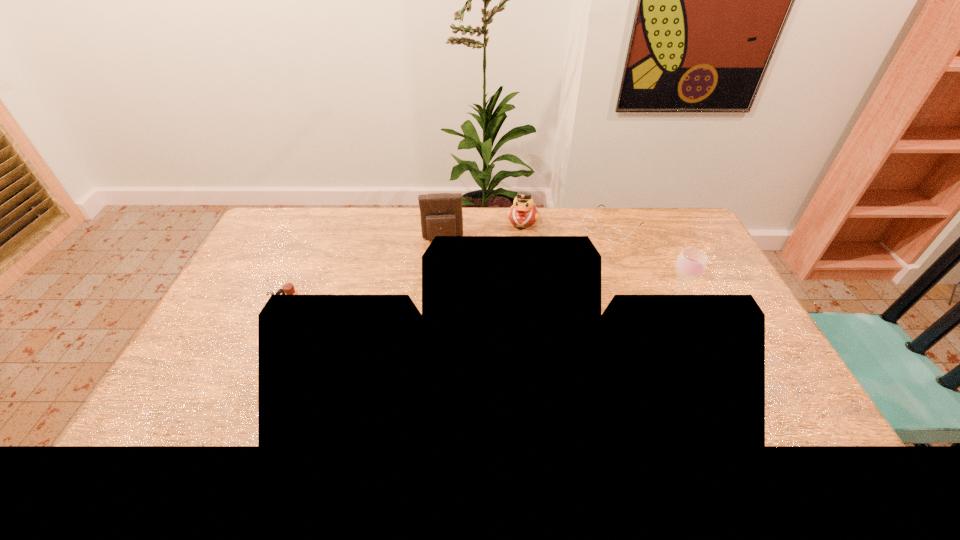
Identify the location of the leftmost object. (288, 289).

The width and height of the screenshot is (960, 540). Identify the location of wineglass. (691, 263).

Identify the location of the second object from left to right. (441, 214).

Locate an element on the screen. Image resolution: width=960 pixels, height=540 pixels. duck is located at coordinates (523, 213).

Identify the location of spectacles. The height and width of the screenshot is (540, 960). tap(614, 235).

Find the location of a particular element. The image size is (960, 540). vacant area located holding a crossbow in the hands of the Lego is located at coordinates (257, 310).

Where is `free space located 0.120m holding a crossbow in the hands of the Lego`? The image size is (960, 540). free space located 0.120m holding a crossbow in the hands of the Lego is located at coordinates (235, 310).

Find the location of a particular element. The width and height of the screenshot is (960, 540). vacant point located holding a crossbow in the hands of the Lego is located at coordinates (231, 310).

Where is `vacant space located on the front of the wineglass`? The image size is (960, 540). vacant space located on the front of the wineglass is located at coordinates (719, 408).

The height and width of the screenshot is (540, 960). I want to click on vacant space located 0.240m with an open flap on the pouch, so click(446, 291).